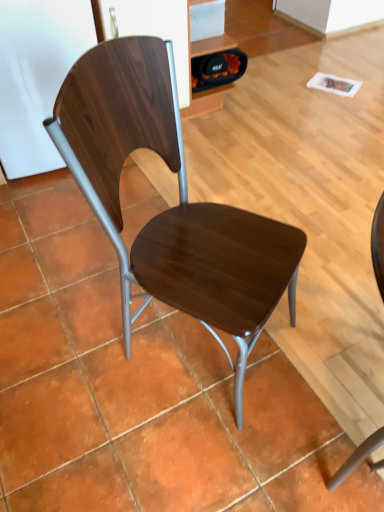
This screenshot has height=512, width=384. I want to click on vacant space in shiny dark wood chair at center (from a real-world perspective), so click(x=196, y=351).